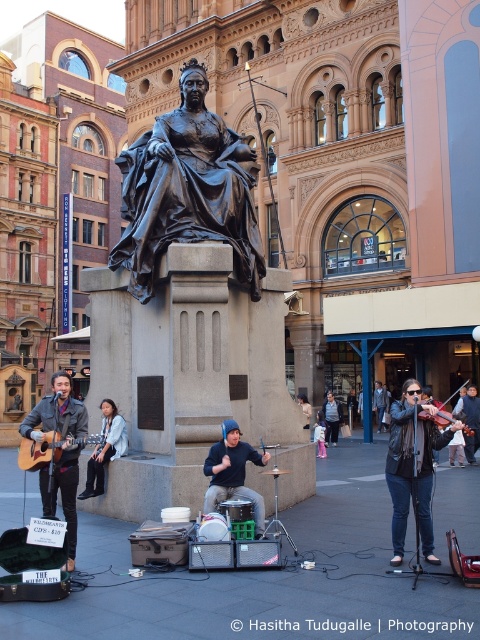
You are a street performer who just finished a set. You have a matte black guitar at left and a black drum set at center. You need to quickly grab your items and leave. Which item should you reach for first to minimize the distance you have to move?

The matte black guitar at left is closer to the viewer than the black drum set at center, so you should reach for the matte black guitar at left first to minimize the distance you have to move.

You are a street performer who has just finished a performance. You need to place your black drum set at center and your leather jacket at center into a storage room that can only accommodate items up to the size of the larger object. Which object should you prioritize placing first?

The leather jacket at center has a larger width than the black drum set at center, so you should prioritize placing the leather jacket at center first since it requires more space and the storage room can only accommodate items up to its size.

You are a street performer who wants to set up a drumming performance. You see the black polished statue at center and the black drum set at center in the image. Which object is taller and should you avoid placing your drumming setup too close to it?

The black polished statue at center is taller than the black drum set at center, so you should avoid placing your drumming setup too close to the black polished statue at center to prevent blocking the view of the taller object.